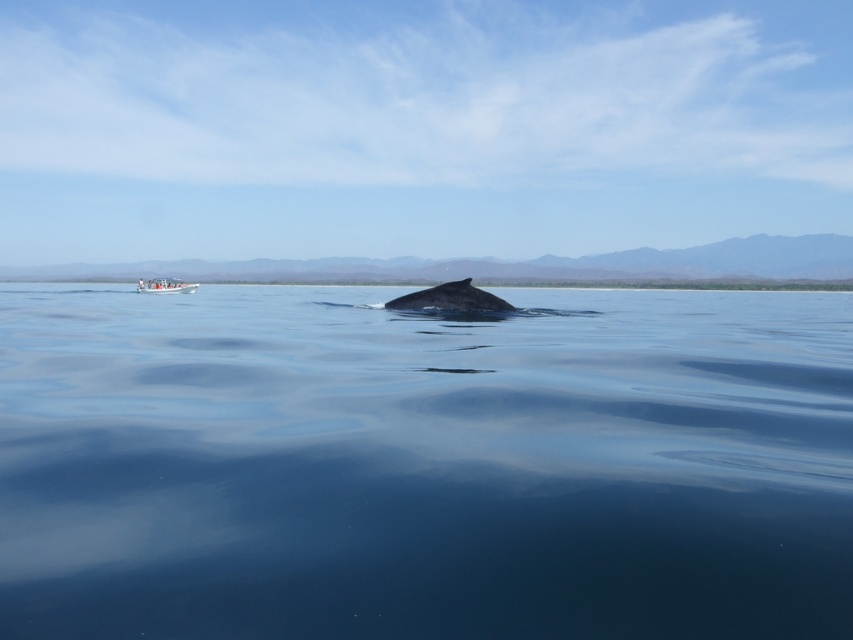
You are standing at the point with coordinates point (466,292) and want to walk to the point with coordinates point (189,284). Which direction should you move to get closer to your destination?

To move closer to the point (189,284) from point (466,292), you should move downward since point (466,292) is closer to the camera than point (189,284).

You are a marine biologist observing the ocean scene. You notice a point labeled as point [424,465]. Based on the scene description, what does this point most likely represent?

The point [424,465] corresponds to clear blue water at center, which is part of the calm ocean surface reflecting the sky and mountains.

You are a marine biologist observing the ocean scene. You notice the clear blue water at center and the smooth gray whale at center. Which object occupies a greater area in the image?

The clear blue water at center is larger in size than the smooth gray whale at center, so it occupies a greater area in the image.